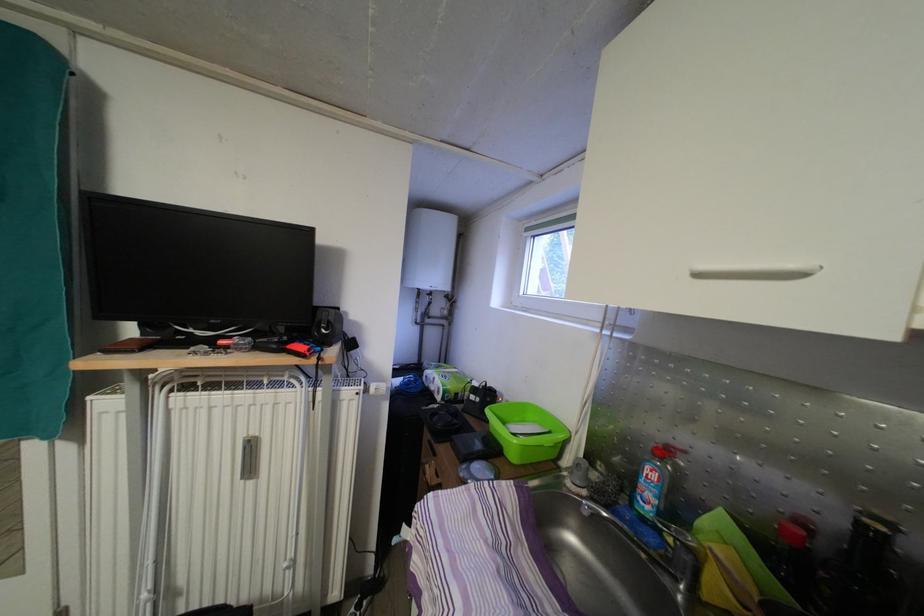
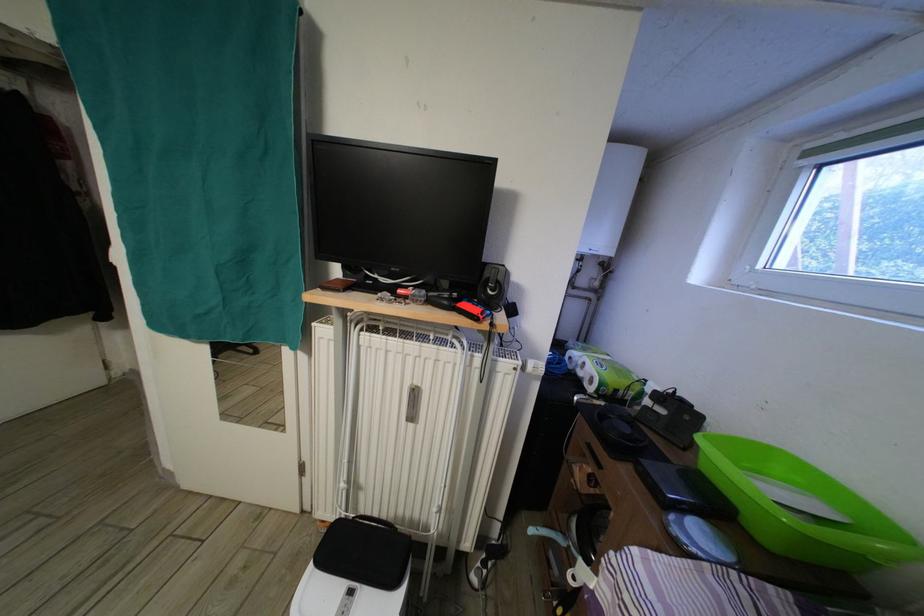
Based on the photo, in a continuous first-person perspective shot, in which direction is the camera moving?

The cameraman moved toward left, forward.